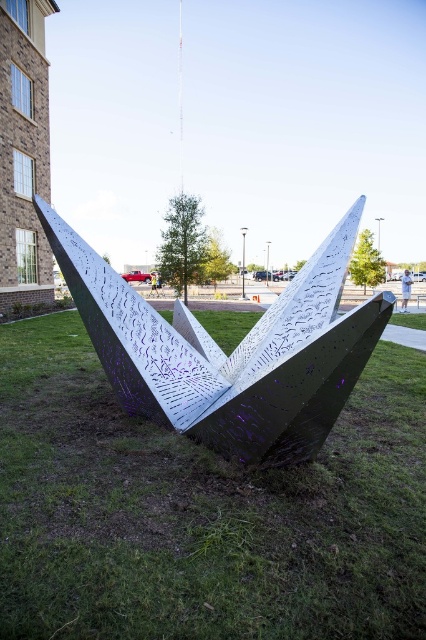
Question: Which point appears closest to the camera in this image?

Choices:
 (A) (261, 595)
 (B) (161, 360)

Answer: (A)

Question: Which of the following is the closest to the observer?

Choices:
 (A) (36, 417)
 (B) (137, 381)

Answer: (B)

Question: Does metallic grass at center come in front of metallic silver sculpture at center?

Choices:
 (A) no
 (B) yes

Answer: (B)

Question: Which point appears farthest from the camera in this image?

Choices:
 (A) (97, 332)
 (B) (391, 506)

Answer: (A)

Question: Can you confirm if metallic grass at center is positioned to the left of metallic silver sculpture at center?

Choices:
 (A) no
 (B) yes

Answer: (B)

Question: From the image, what is the correct spatial relationship of metallic grass at center in relation to metallic silver sculpture at center?

Choices:
 (A) right
 (B) left

Answer: (B)